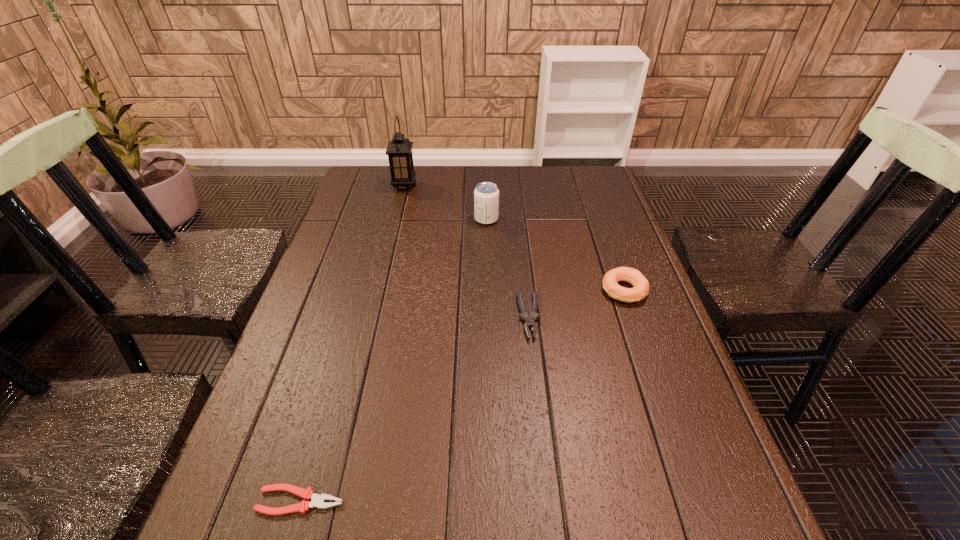
This screenshot has width=960, height=540. Find the location of `lantern`. lantern is located at coordinates (399, 150).

In order to click on the farthest object in this screenshot , I will do `click(399, 150)`.

Where is `the second tallest object`? the second tallest object is located at coordinates (486, 194).

Image resolution: width=960 pixels, height=540 pixels. In order to click on the second farthest object in this screenshot , I will do tap(486, 194).

Find the location of `bagel`. bagel is located at coordinates point(640,290).

The height and width of the screenshot is (540, 960). Find the location of `the third shortest object`. the third shortest object is located at coordinates (640, 290).

You are a GUI agent. You are given a task and a screenshot of the screen. Output one action in this format:
    pyautogui.click(x=<x>, y=<y>)
    Task: Click on the taller pliers
    This screenshot has height=540, width=960.
    Given the screenshot: What is the action you would take?
    pyautogui.click(x=529, y=322)

I want to click on the second object from right to left, so click(529, 322).

The image size is (960, 540). Find the location of `the left pliers`. the left pliers is located at coordinates (318, 501).

You are a GUI agent. You are given a task and a screenshot of the screen. Output one action in this format:
    pyautogui.click(x=<x>, y=<y>)
    Task: Click on the nearest object
    
    Given the screenshot: What is the action you would take?
    pyautogui.click(x=318, y=501)